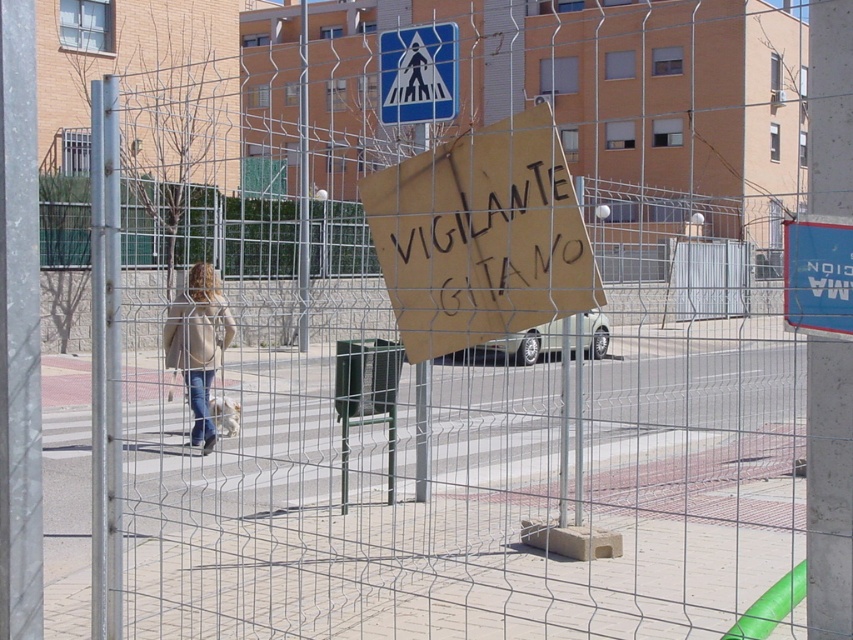
Question: Considering the real-world distances, which object is farthest from the light beige jacket at center?

Choices:
 (A) blue plastic sign at upper right
 (B) brushed metal pole at center
 (C) blue plastic pedestrian crossing sign at upper center

Answer: (B)

Question: Can you confirm if light beige jacket at center is positioned to the right of brushed metal pole at center?

Choices:
 (A) no
 (B) yes

Answer: (B)

Question: Considering the real-world distances, which object is farthest from the blue plastic sign at upper right?

Choices:
 (A) blue plastic pedestrian crossing sign at upper center
 (B) light beige jacket at center

Answer: (B)

Question: Is blue plastic sign at upper right bigger than blue plastic pedestrian crossing sign at upper center?

Choices:
 (A) yes
 (B) no

Answer: (B)

Question: Which point is farther to the camera?

Choices:
 (A) (225, 346)
 (B) (456, 28)
 (C) (836, 252)

Answer: (A)

Question: Is light beige jacket at center behind brushed metal pole at center?

Choices:
 (A) no
 (B) yes

Answer: (A)